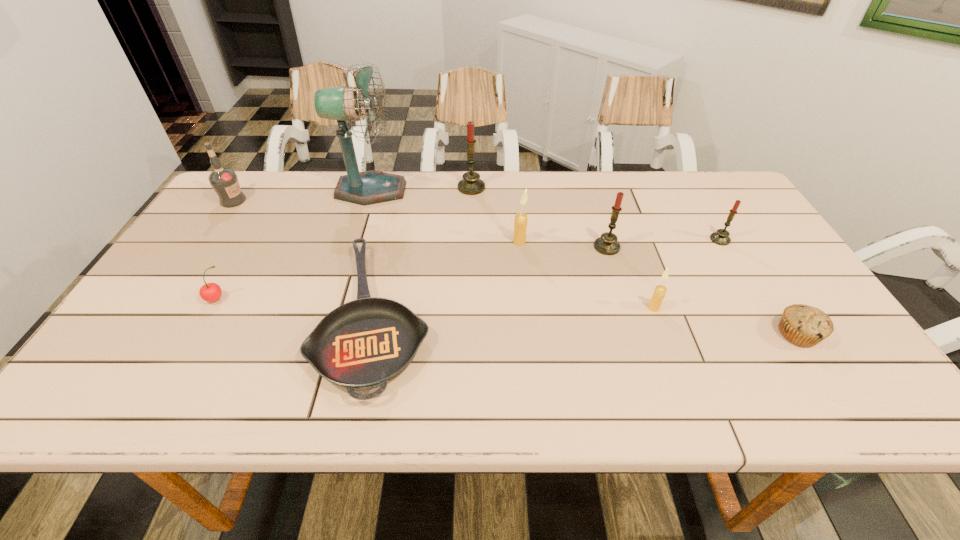
Find the location of a particular element. The image size is (960, 540). vacant space at the right edge is located at coordinates (744, 287).

You are a GUI agent. You are given a task and a screenshot of the screen. Output one action in this format:
    pyautogui.click(x=<x>, y=<y>)
    Task: Click on the vacant area at the far left corner
    The height and width of the screenshot is (540, 960).
    Given the screenshot: What is the action you would take?
    pyautogui.click(x=267, y=187)

Where is `free area in between the tallest candle and the fourth object from right to left`? This screenshot has width=960, height=540. free area in between the tallest candle and the fourth object from right to left is located at coordinates (540, 217).

Locate an element on the screen. free spot between the shortest object and the leftmost object is located at coordinates (304, 258).

What are the coordinates of `free space between the red cherry and the leftmost object` in the screenshot? It's located at (226, 250).

Locate an element on the screen. This screenshot has height=540, width=960. free space between the second shortest object and the leftmost red candle is located at coordinates click(x=635, y=261).

At what (x,y) coordinates should I click in order to perform the action: click on unoccupied area between the seventh object from left to right and the sixth object from left to right. Please return your answer as a coordinate pair (x, y). Looking at the image, I should click on (563, 244).

Where is `vacant region between the sixth object from left to right and the tallest object`? vacant region between the sixth object from left to right and the tallest object is located at coordinates (445, 216).

The image size is (960, 540). Find the location of `free space between the ninth object from right to left and the smaller cream candle`. free space between the ninth object from right to left and the smaller cream candle is located at coordinates (436, 303).

This screenshot has height=540, width=960. Identify the location of vacant space in between the red cherry and the second smallest red candle. (412, 273).